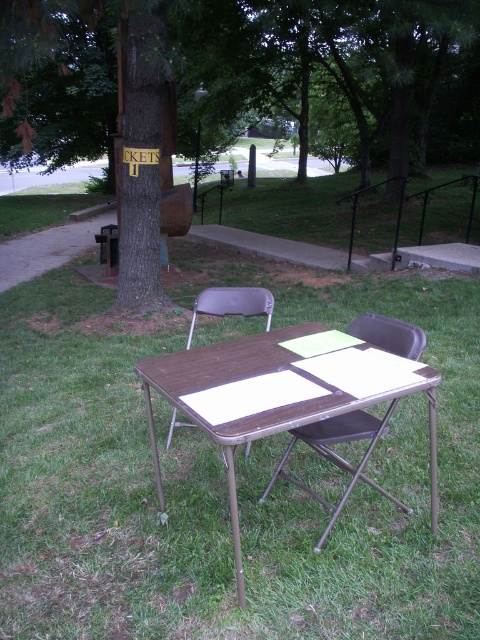
Does green grass at center appear over brown wood tree at center?

No.

Which of these two, green grass at center or brown wood tree at center, stands shorter?

green grass at center is shorter.

Locate an element on the screen. This screenshot has width=480, height=640. green grass at center is located at coordinates [x=226, y=477].

The width and height of the screenshot is (480, 640). I want to click on brown wood tree at center, so click(220, 61).

Can you confirm if brown wood tree at center is bigger than brown plastic chair at center?

Indeed, brown wood tree at center has a larger size compared to brown plastic chair at center.

Describe the element at coordinates (220, 61) in the screenshot. I see `brown wood tree at center` at that location.

The image size is (480, 640). I want to click on brown wood tree at center, so click(220, 61).

Is brown wood tree at center taller than brown/metallic picnic table at center?

Correct, brown wood tree at center is much taller as brown/metallic picnic table at center.

Which is in front, point (156, 205) or point (263, 353)?

Point (263, 353) is more forward.

Does point (298, 42) come behind point (226, 340)?

Yes, it is.

What are the coordinates of `brown wood tree at center` in the screenshot? It's located at (220, 61).